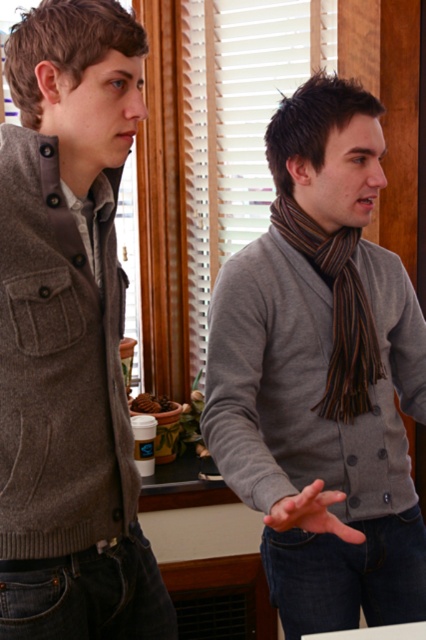
Is gray wool sweater at center shorter than gray wool cardigan at left?

Incorrect, gray wool sweater at center's height does not fall short of gray wool cardigan at left's.

Can you confirm if gray wool sweater at center is taller than gray wool cardigan at left?

Yes, gray wool sweater at center is taller than gray wool cardigan at left.

Where is `gray wool sweater at center`? The width and height of the screenshot is (426, 640). gray wool sweater at center is located at coordinates (322, 376).

Consider the image. Can you confirm if gray wool sweater at center is positioned to the left of striped wool scarf at center?

Correct, you'll find gray wool sweater at center to the left of striped wool scarf at center.

Which is above, gray wool sweater at center or striped wool scarf at center?

Positioned higher is striped wool scarf at center.

You are a GUI agent. You are given a task and a screenshot of the screen. Output one action in this format:
    pyautogui.click(x=<x>, y=<y>)
    Task: Click on the gray wool sweater at center
    This screenshot has width=426, height=640.
    Given the screenshot: What is the action you would take?
    pyautogui.click(x=322, y=376)

In order to click on gray wool sweater at center in this screenshot , I will do `click(322, 376)`.

Can you confirm if gray wool cardigan at left is smaller than striped wool scarf at center?

No, gray wool cardigan at left is not smaller than striped wool scarf at center.

Is gray wool cardigan at left shorter than striped wool scarf at center?

Incorrect, gray wool cardigan at left's height does not fall short of striped wool scarf at center's.

Does point (65, 324) come closer to viewer compared to point (328, 257)?

Yes.

Identify the location of gray wool cardigan at left. (69, 336).